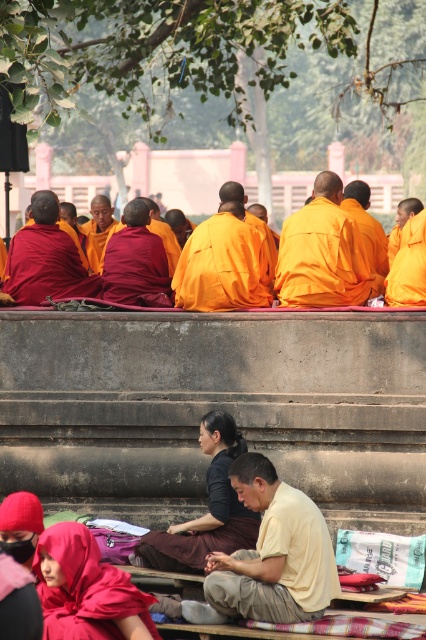
You are a photographer trying to capture the scene from above. You notice the yellow matte shirt at center and the orange matte robe at right. Which object would be closer to the bottom of your photo if you take it from this angle?

The yellow matte shirt at center is positioned under the orange matte robe at right, so it would be closer to the bottom of the photo.

You are a visitor at this temple and want to join the meditation session. The orange matte robe at right and the orange robe monk at center are part of the group. If you want to sit between them, will there be enough space for you?

The distance between the orange matte robe at right and the orange robe monk at center is 19.28 meters. Since the space between them is quite large, there is sufficient room for you to sit in between.